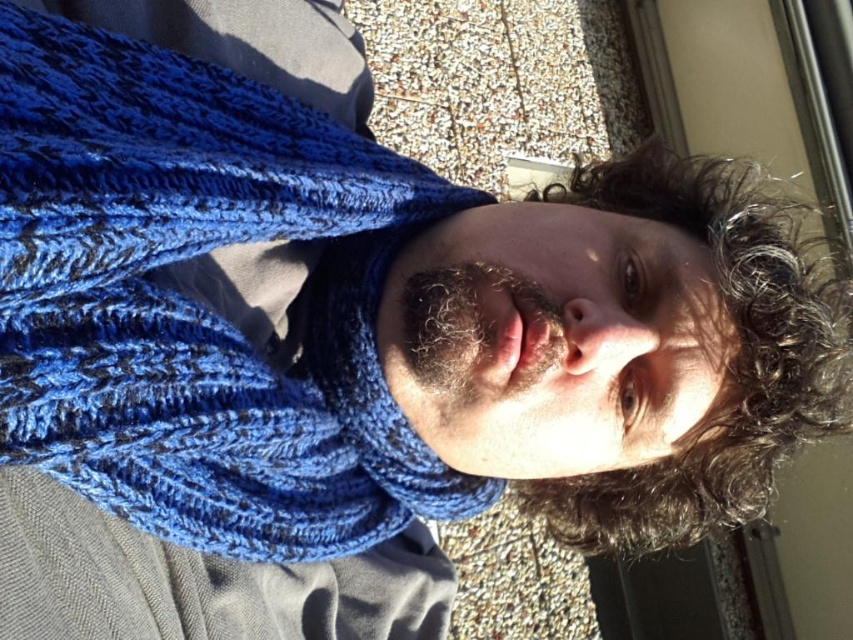
You are standing in front of the person in the image and want to place a small gift box exactly where the blue knitted scarf at center is. Can you determine the exact coordinates to place the gift box?

The blue knitted scarf at center is located at point (199, 304), so you should place the gift box at those coordinates.

You are a photographer adjusting the lighting for a portrait. You notice the blue knitted scarf at center and the curly brown hair at upper right. Which object is closer to the camera based on their positions?

The curly brown hair at upper right is closer to the camera because it is positioned above the blue knitted scarf at center, which is placed underneath it.

You are a fashion designer observing the person in the image. You need to determine if the blue knitted scarf at center can be replaced with a wider scarf without covering the curly brown hair at upper right. Can you confirm if this is possible?

The blue knitted scarf at center has a lesser width compared to curly brown hair at upper right, so a wider scarf could potentially be used without covering the curly brown hair at upper right, provided it does not extend beyond the current position.